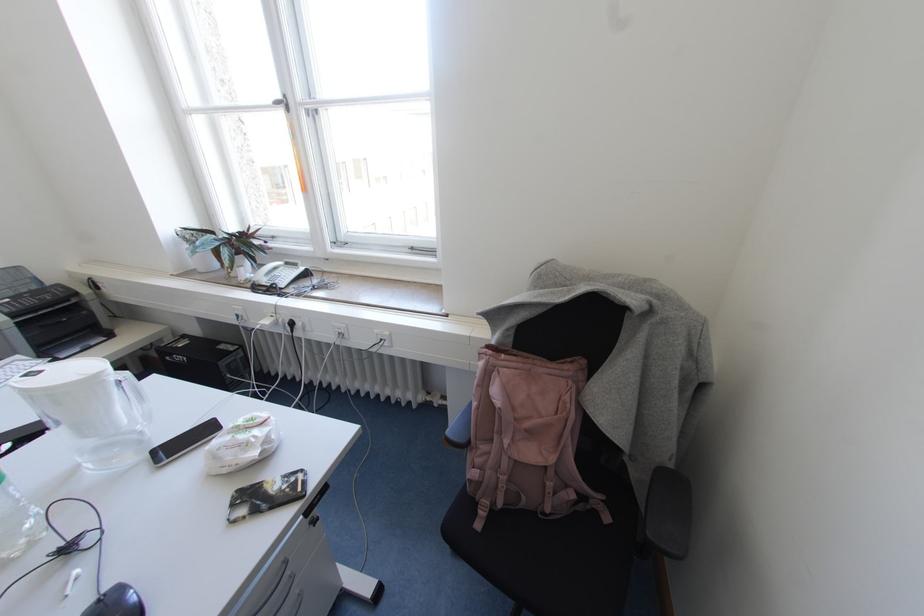
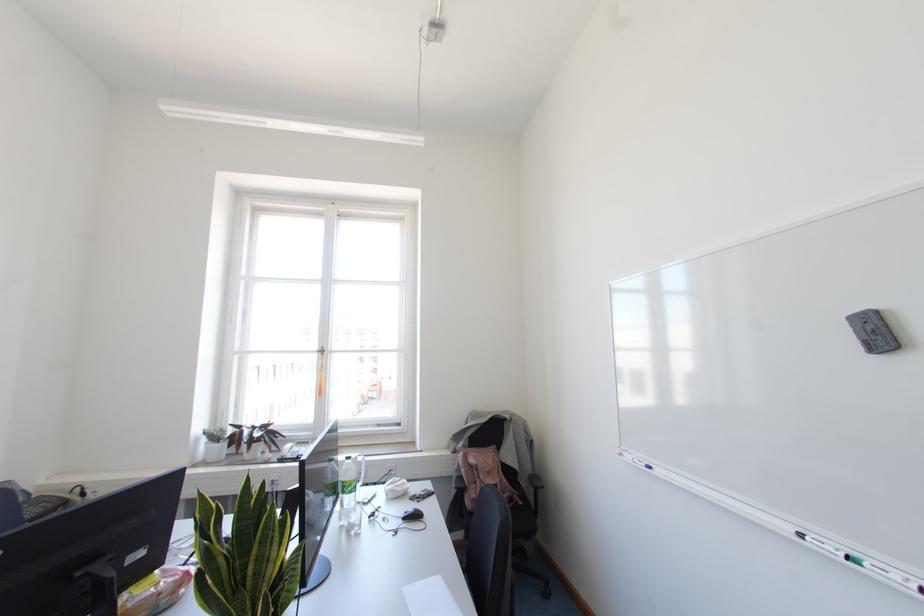
The point at [287,108] is marked in the first image. Where is the corresponding point in the second image?

(322, 353)